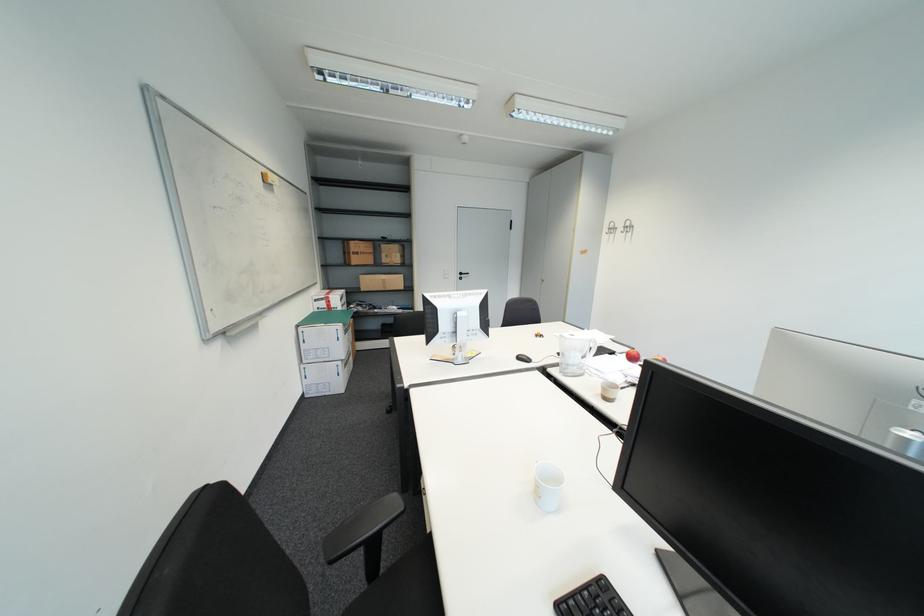
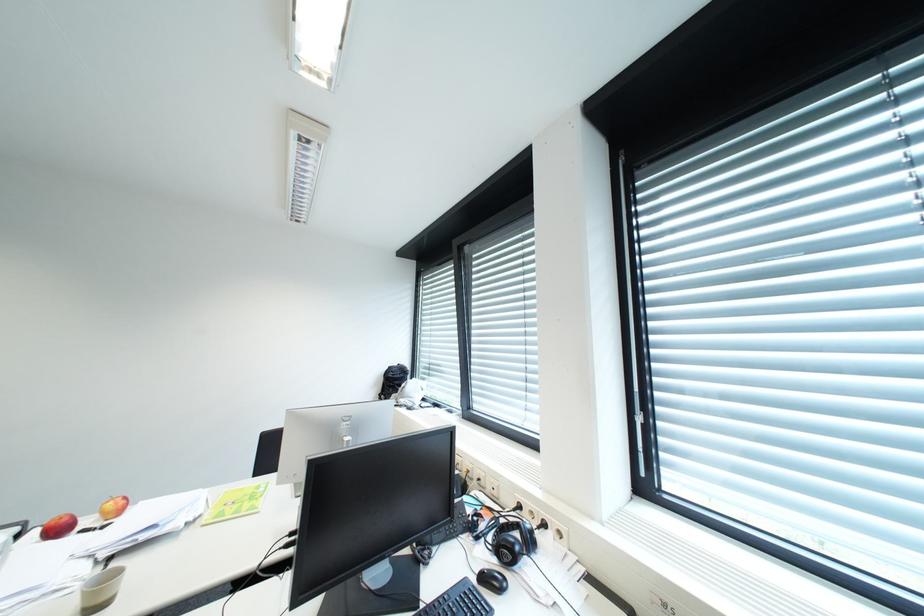
Question: Based on the continuous images, in which direction is the camera rotating? Reply with the corresponding letter.

Choices:
 (A) Left
 (B) Right
 (C) Up
 (D) Down

Answer: (B)